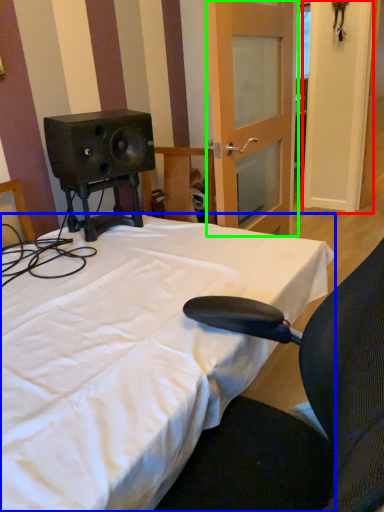
Question: Which is farther away from door (highlighted by a red box)? bed (highlighted by a blue box) or door (highlighted by a green box)?

Choices:
 (A) bed
 (B) door

Answer: (A)